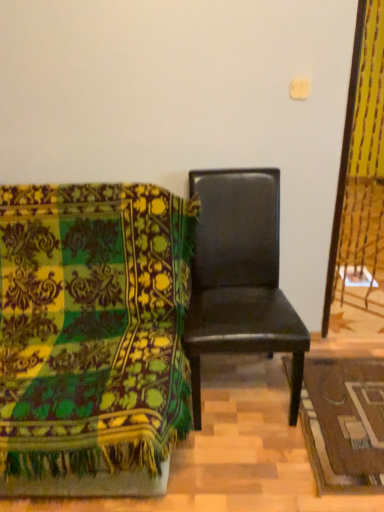
The height and width of the screenshot is (512, 384). I want to click on blank space situated above brown woven mat at lower right (from a real-world perspective), so click(x=346, y=411).